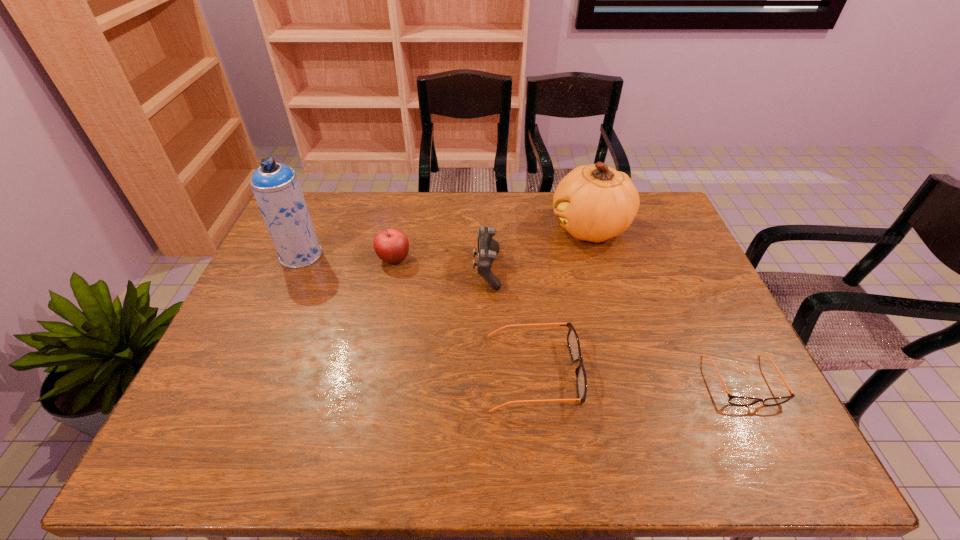
Identify the location of vacant point located between the tallest object and the apple. (348, 257).

Locate an element on the screen. This screenshot has width=960, height=540. blank region between the shortest object and the aerosol can is located at coordinates (522, 318).

Locate an element on the screen. This screenshot has height=540, width=960. empty space that is in between the leftmost object and the right spectacles is located at coordinates (522, 318).

Identify the location of empty location between the taller spectacles and the control. The width and height of the screenshot is (960, 540). (511, 321).

Identify the location of vacant space in between the right spectacles and the fifth object from right to left. (568, 320).

Where is `empty space that is in between the shorter spectacles and the control`? This screenshot has width=960, height=540. empty space that is in between the shorter spectacles and the control is located at coordinates (614, 326).

The image size is (960, 540). In order to click on free space that is in between the control and the taller spectacles in this screenshot , I will do `click(511, 321)`.

At what (x,y) coordinates should I click in order to perform the action: click on empty location between the control and the second object from left to right. Please return your answer as a coordinate pair (x, y). The height and width of the screenshot is (540, 960). Looking at the image, I should click on (441, 265).

The image size is (960, 540). What are the coordinates of `object that is the fourth closest to the control` in the screenshot? It's located at (276, 187).

Locate which object is the closest to the aerosol can. Please provide its 2D coordinates. Your answer should be formatted as a tuple, i.e. [(x, y)], where the tuple contains the x and y coordinates of a point satisfying the conditions above.

[(391, 245)]